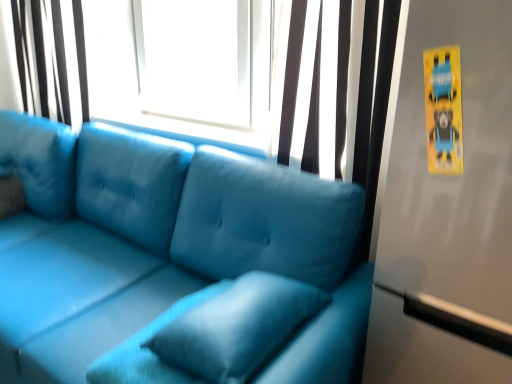
Question: Is velvet blue pillow at center located within matte blue couch at center?

Choices:
 (A) yes
 (B) no

Answer: (A)

Question: Is matte blue couch at center taller than velvet blue pillow at center?

Choices:
 (A) yes
 (B) no

Answer: (A)

Question: Is matte blue couch at center thinner than velvet blue pillow at center?

Choices:
 (A) yes
 (B) no

Answer: (B)

Question: Considering the relative sizes of matte blue couch at center and velvet blue pillow at center in the image provided, is matte blue couch at center bigger than velvet blue pillow at center?

Choices:
 (A) yes
 (B) no

Answer: (A)

Question: Is matte blue couch at center with velvet blue pillow at center?

Choices:
 (A) yes
 (B) no

Answer: (B)

Question: Can you confirm if matte blue couch at center is wider than velvet blue pillow at center?

Choices:
 (A) yes
 (B) no

Answer: (A)

Question: Is matte white curtain at upper left, marked as the 1th curtain in a back-to-front arrangement, positioned before velvet blue pillow at center?

Choices:
 (A) no
 (B) yes

Answer: (A)

Question: Is matte white curtain at upper left, which appears as the second curtain when viewed from the front, located outside velvet blue pillow at center?

Choices:
 (A) yes
 (B) no

Answer: (A)

Question: Considering the relative sizes of matte white curtain at upper left, marked as the 1th curtain in a back-to-front arrangement, and velvet blue pillow at center in the image provided, is matte white curtain at upper left, marked as the 1th curtain in a back-to-front arrangement, shorter than velvet blue pillow at center?

Choices:
 (A) no
 (B) yes

Answer: (A)

Question: Is velvet blue pillow at center surrounded by matte white curtain at upper left, which is counted as the first curtain, starting from the left?

Choices:
 (A) no
 (B) yes

Answer: (A)

Question: From a real-world perspective, is matte white curtain at upper left, which is counted as the first curtain, starting from the left, on velvet blue pillow at center?

Choices:
 (A) yes
 (B) no

Answer: (A)

Question: Is matte white curtain at upper left, which is counted as the first curtain, starting from the left, next to velvet blue pillow at center?

Choices:
 (A) yes
 (B) no

Answer: (B)

Question: Is matte black curtain at upper center, the second curtain viewed from the back, at the right side of matte blue couch at center?

Choices:
 (A) no
 (B) yes

Answer: (B)